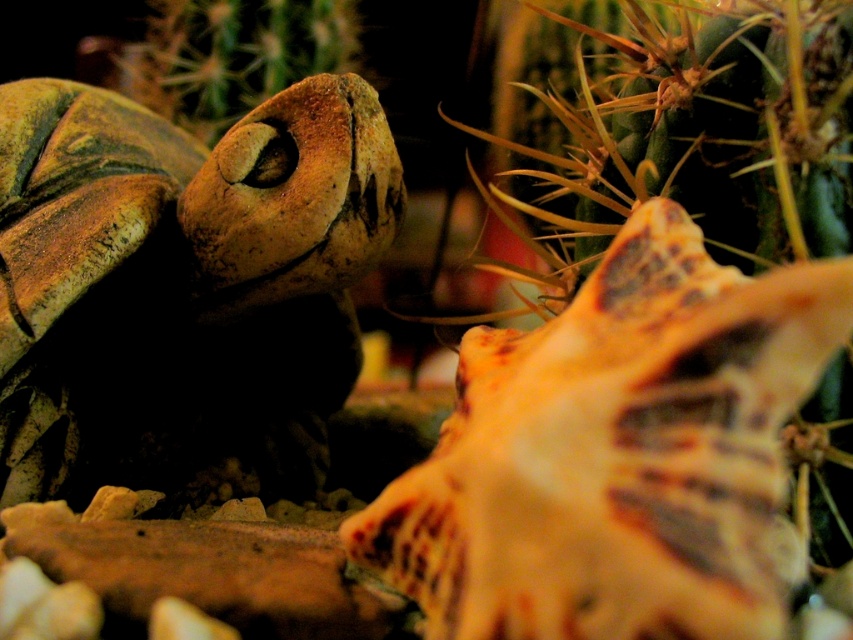
You are a photographer trying to capture the turtle in the terrarium. The turtle is at point (183,288). Where is the turtle located in the scene?

The turtle is located at the center of the scene, as point (183,288) corresponds to the matte brown tortoise at center.

You are setting up a small garden and have a matte brown tortoise at center and a brown textured cactus at upper left. Which object is located lower in the scene?

The matte brown tortoise at center is positioned under the brown textured cactus at upper left, so it is located lower in the scene.